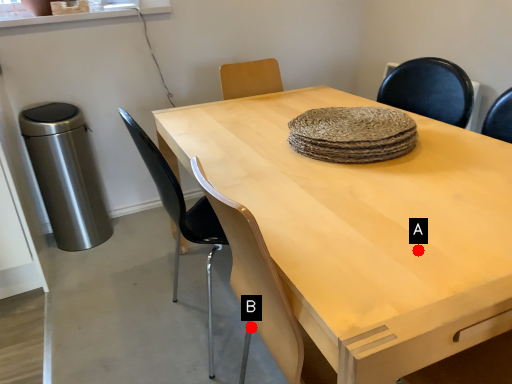
Question: Two points are circled on the image, labeled by A and B beside each circle. Which of the following is the farthest from the observer?

Choices:
 (A) A is further
 (B) B is further

Answer: (B)